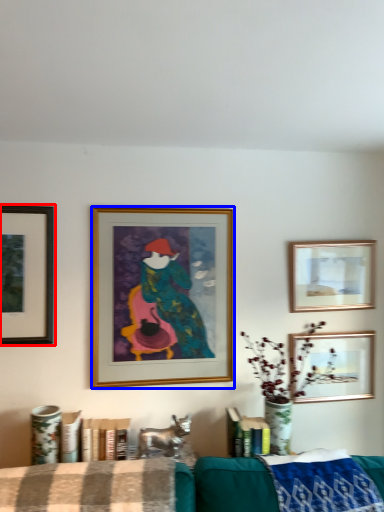
Question: Which object appears farthest to the camera in this image, picture frame (highlighted by a red box) or picture frame (highlighted by a blue box)?

Choices:
 (A) picture frame
 (B) picture frame

Answer: (B)